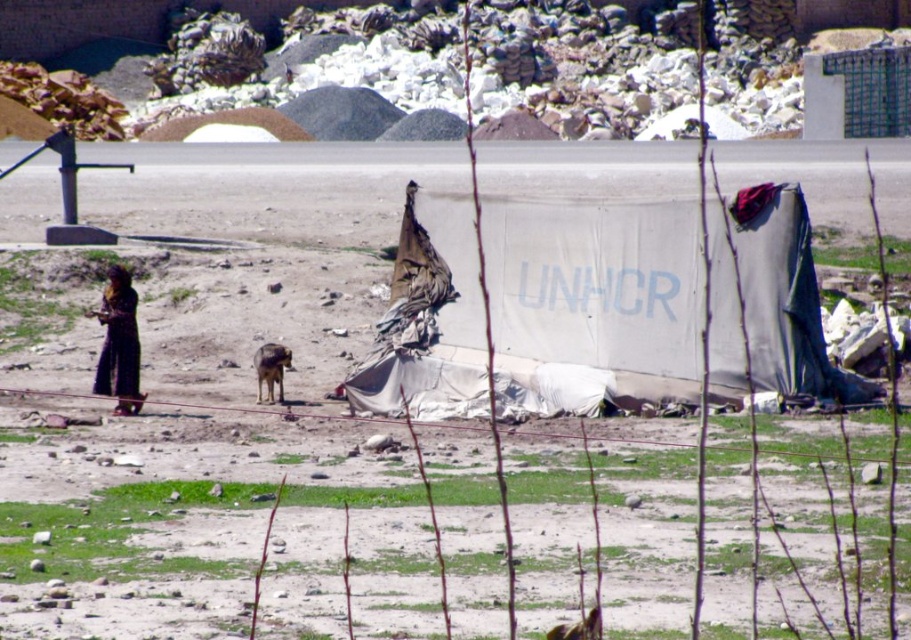
You are standing at the point labeled point (582,356) and want to walk to the point labeled point (132,396). Which direction should you move in to get closer to your destination?

You should move downward because point (582,356) is closer to the camera than point (132,396), meaning it is positioned higher up in the frame. To reach the lower point, you need to move downward.

You are a relief worker in a refugee camp. You need to determine which object, the white tarp at center or the black fabric at left, can be used to cover a taller structure. Based on the scene description, which one would you choose?

The white tarp at center is taller than the black fabric at left, so it would be the better choice for covering a taller structure.

You are a delivery person who needs to place a package between the white tarp at center and the black fabric at left. The package requires a space of 12 feet. Will there be enough space between them?

The distance between the white tarp at center and the black fabric at left is 13.60 feet, which is more than the required 12 feet. Therefore, there is sufficient space to place the package between them.